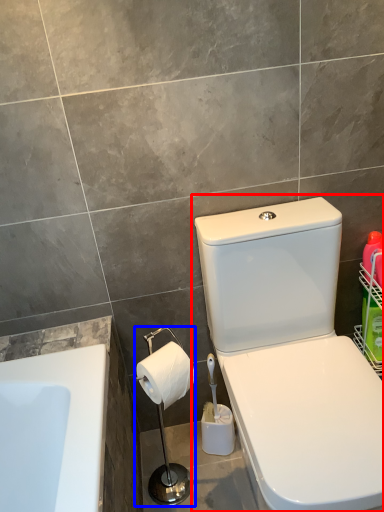
Question: Among these objects, which one is farthest to the camera, toilet (highlighted by a red box) or shower (highlighted by a blue box)?

Choices:
 (A) toilet
 (B) shower

Answer: (B)